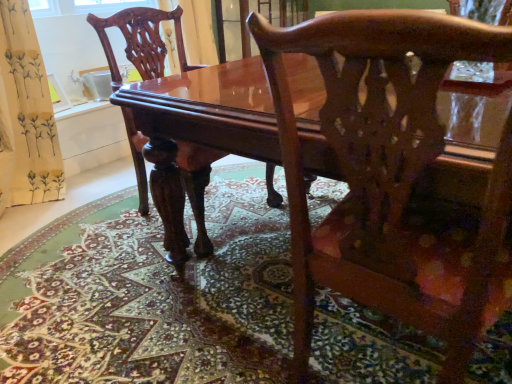
Question: Is glossy wood chair at center, which ranks as the 1th chair in right-to-left order, wider or thinner than carpeted floor at center?

Choices:
 (A) wide
 (B) thin

Answer: (B)

Question: From their relative heights in the image, would you say glossy wood chair at center, acting as the first chair starting from the front, is taller or shorter than carpeted floor at center?

Choices:
 (A) short
 (B) tall

Answer: (B)

Question: Estimate the real-world distances between objects in this image. Which object is farther from the glossy wood chair at center, which is the second chair in back-to-front order?

Choices:
 (A) glossy wood table at center
 (B) carpeted floor at center
 (C) glossy wood chair at center, the second chair viewed from the right

Answer: (C)

Question: Which object is the farthest from the glossy wood chair at center, which is the first chair in left-to-right order?

Choices:
 (A) carpeted floor at center
 (B) glossy wood chair at center, acting as the first chair starting from the front
 (C) glossy wood table at center

Answer: (B)